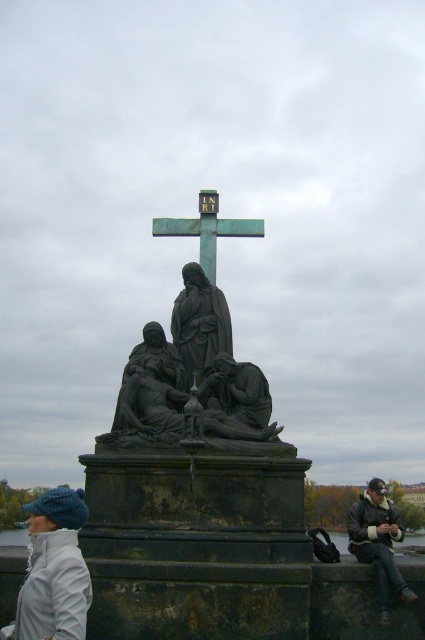
Question: Which of the following is the farthest from the observer?

Choices:
 (A) bronze statue at center
 (B) dark brown leather jacket at lower right
 (C) dark gray stone statue at center
 (D) white woolen hat at lower left

Answer: (C)

Question: Which object is positioned farthest from the bronze statue at center?

Choices:
 (A) green patinated metal cross at center
 (B) dark brown leather jacket at lower right
 (C) white woolen hat at lower left
 (D) dark gray stone statue at center

Answer: (B)

Question: Is white woolen hat at lower left further to the viewer compared to green patinated metal cross at center?

Choices:
 (A) yes
 (B) no

Answer: (B)

Question: Which of the following is the farthest from the observer?

Choices:
 (A) (206, 189)
 (B) (178, 339)
 (C) (198, 456)

Answer: (A)

Question: Can you confirm if dark brown leather jacket at lower right is smaller than green patinated metal cross at center?

Choices:
 (A) yes
 (B) no

Answer: (B)

Question: Is bronze statue at center to the left of white woolen hat at lower left from the viewer's perspective?

Choices:
 (A) no
 (B) yes

Answer: (A)